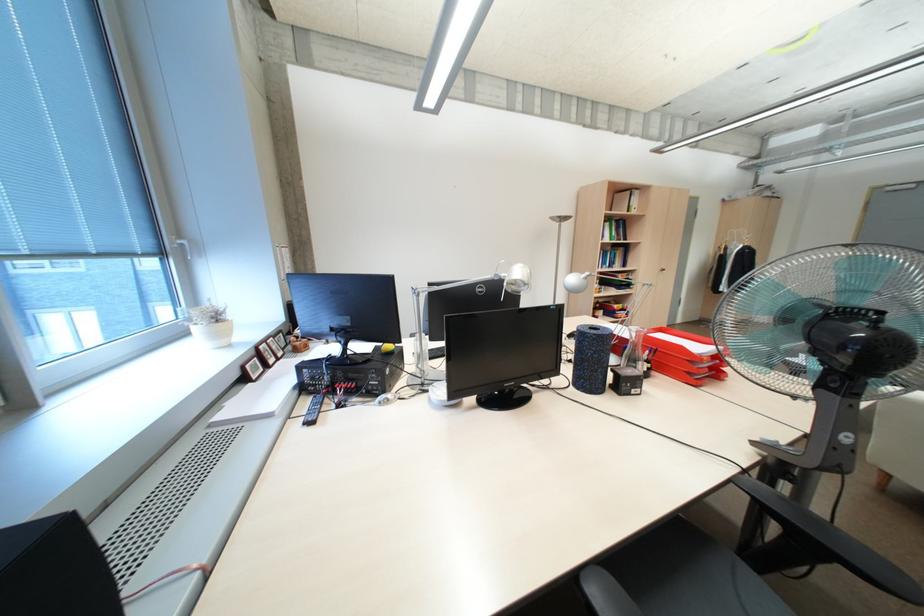
Find where to pull the white window handle. Please return your answer as a coordinate pair (x, y).

(184, 246)